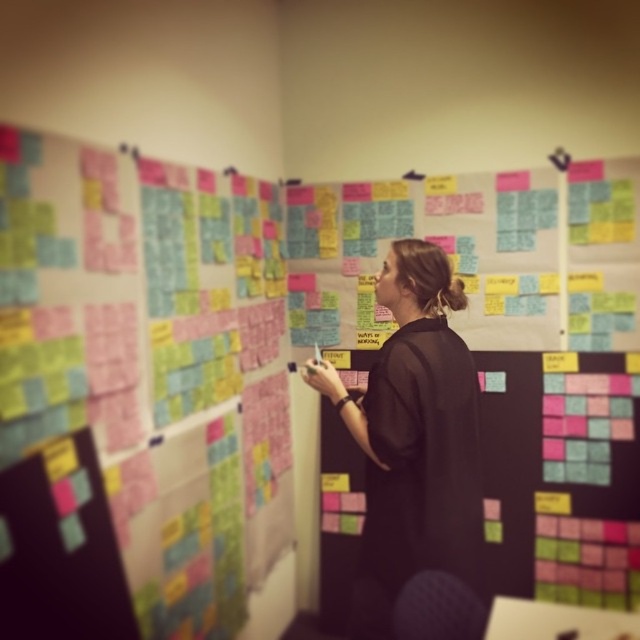
Question: Which of the following is the closest to the observer?

Choices:
 (A) pos(368,403)
 (B) pos(177,522)

Answer: (A)

Question: Which point is farther from the camera taking this photo?

Choices:
 (A) (173, 422)
 (B) (428, 556)

Answer: (A)

Question: Is multicolored sticky notes at left to the left of black matte dress at center from the viewer's perspective?

Choices:
 (A) yes
 (B) no

Answer: (A)

Question: Which point is farther to the camera?

Choices:
 (A) black matte dress at center
 (B) multicolored sticky notes at left

Answer: (A)

Question: Where is multicolored sticky notes at left located in relation to black matte dress at center in the image?

Choices:
 (A) below
 (B) above

Answer: (B)

Question: Does multicolored sticky notes at left appear on the right side of black matte dress at center?

Choices:
 (A) yes
 (B) no

Answer: (B)